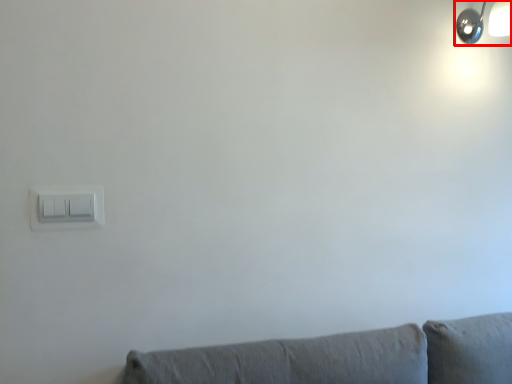
Question: In this image, where is lamp (annotated by the red box) located relative to light switch?

Choices:
 (A) right
 (B) left

Answer: (A)